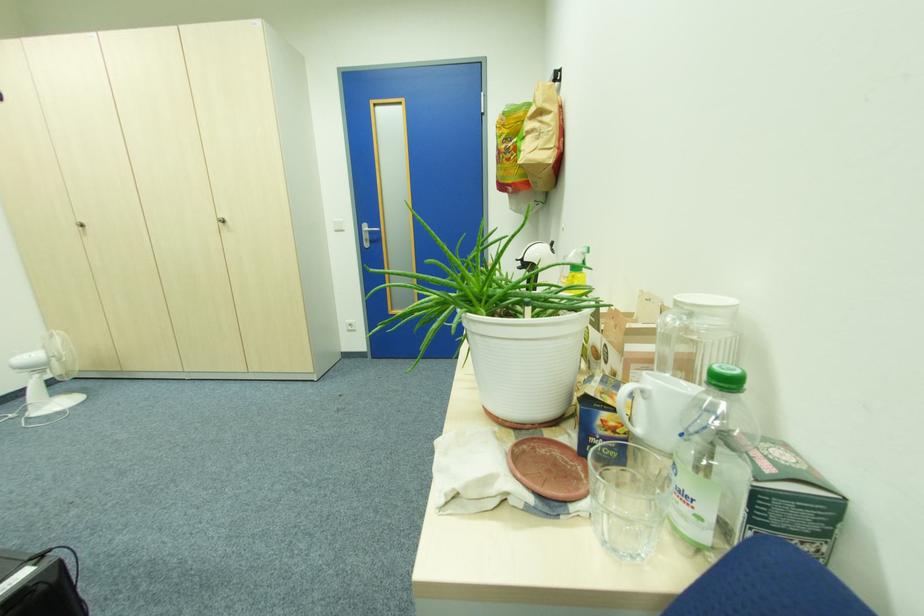
Where would you lift the white mug handle? Please return your answer as a coordinate pair (x, y).

(625, 403)